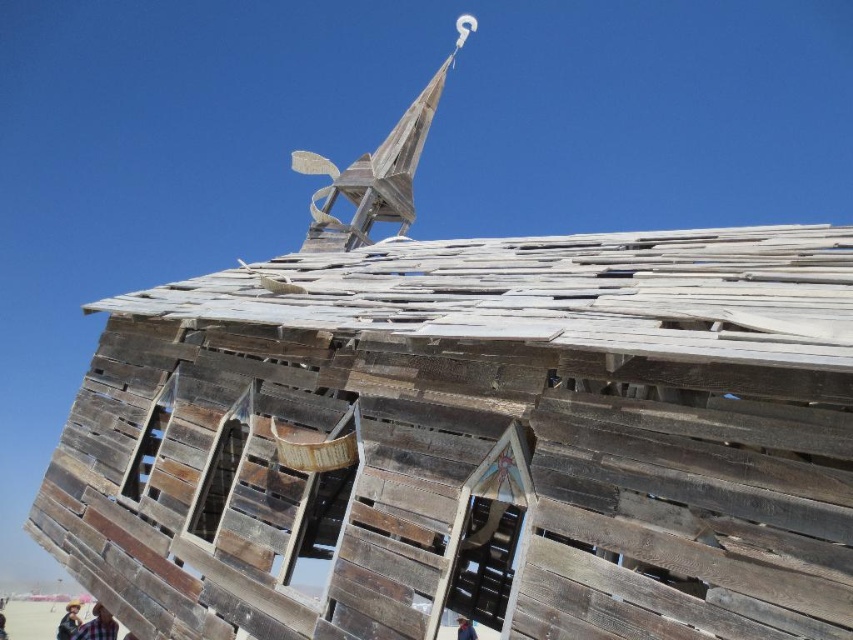
Question: Is wooden planks at lower left smaller than brown leather hat at upper center?

Choices:
 (A) yes
 (B) no

Answer: (B)

Question: Which object appears farthest from the camera in this image?

Choices:
 (A) brown wooden person at lower left
 (B) dark blue fabric at lower left
 (C) wooden spire at upper center
 (D) brown leather hat at upper center

Answer: (A)

Question: Does wooden planks at lower left appear on the left side of brown leather hat at upper center?

Choices:
 (A) no
 (B) yes

Answer: (B)

Question: Among these points, which one is nearest to the camera?

Choices:
 (A) (67, 627)
 (B) (102, 624)

Answer: (B)

Question: Which point is closer to the camera taking this photo?

Choices:
 (A) (473, 630)
 (B) (70, 634)
 (C) (3, 637)

Answer: (A)

Question: Does dark blue fabric at lower left have a lesser width compared to brown leather hat at upper center?

Choices:
 (A) yes
 (B) no

Answer: (B)